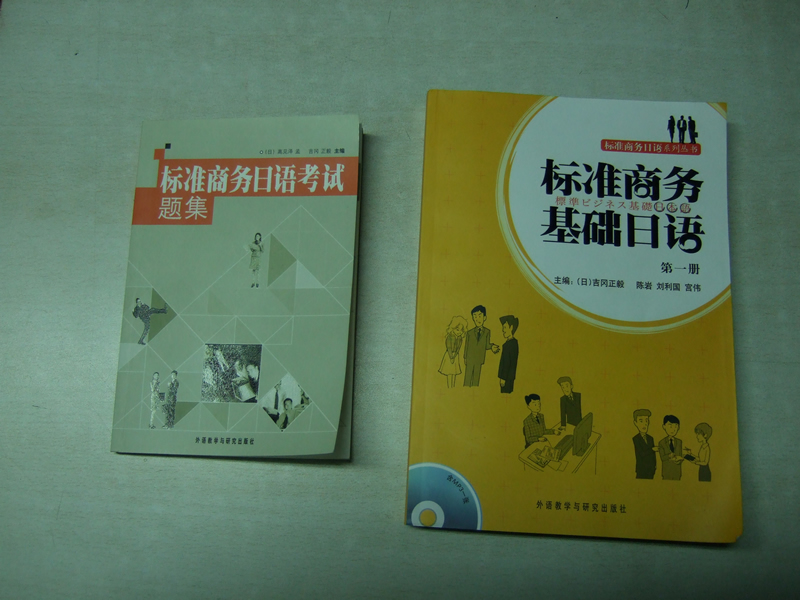
This screenshot has width=800, height=600. I want to click on books, so click(573, 307), click(234, 266).